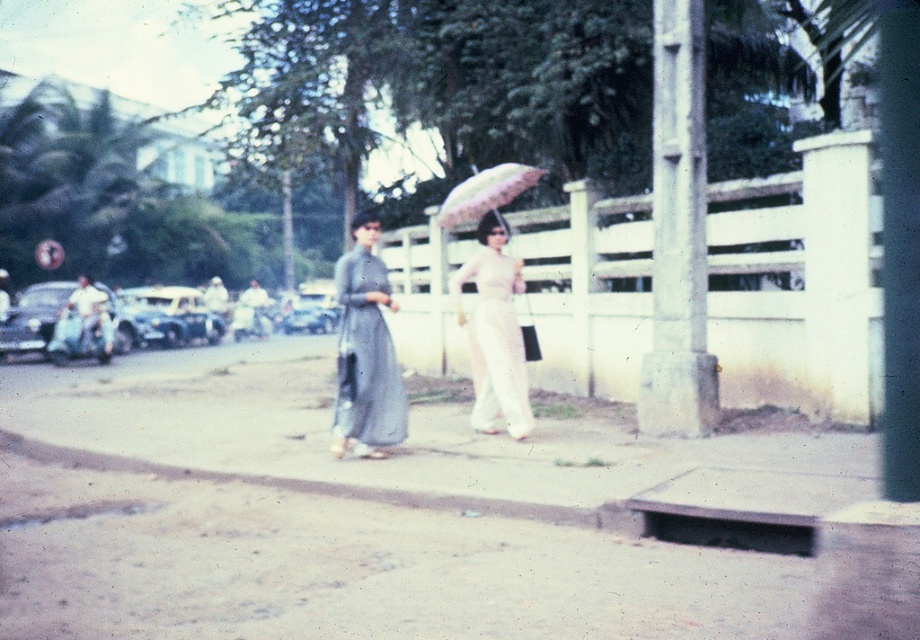
Question: Which is farther from the gray fabric dress at center?

Choices:
 (A) metallic blue car at left
 (B) metallic silver car at left

Answer: (A)

Question: Can you confirm if gray fabric dress at center is smaller than pink fabric umbrella at center?

Choices:
 (A) no
 (B) yes

Answer: (A)

Question: Which object is the closest to the smooth concrete pavement at center?

Choices:
 (A) pink fabric umbrella at center
 (B) gray fabric dress at center

Answer: (B)

Question: From the image, what is the correct spatial relationship of smooth concrete pavement at center in relation to gray fabric dress at center?

Choices:
 (A) right
 (B) left

Answer: (B)

Question: Which object is the closest to the gray fabric dress at center?

Choices:
 (A) smooth concrete pavement at center
 (B) pink fabric umbrella at center
 (C) metallic silver car at left

Answer: (B)

Question: Considering the relative positions of metallic silver car at left and pink fabric umbrella at center in the image provided, where is metallic silver car at left located with respect to pink fabric umbrella at center?

Choices:
 (A) left
 (B) right

Answer: (A)